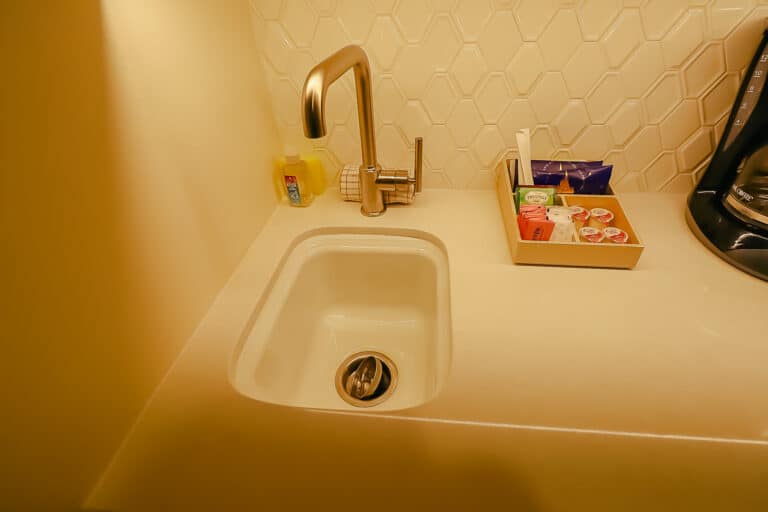
Identify the location of faucet. (322, 93).